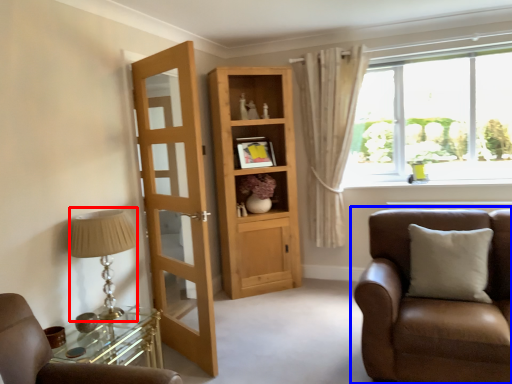
Question: Which point is further to the camera, table lamp (highlighted by a red box) or chair (highlighted by a blue box)?

Choices:
 (A) table lamp
 (B) chair

Answer: (A)